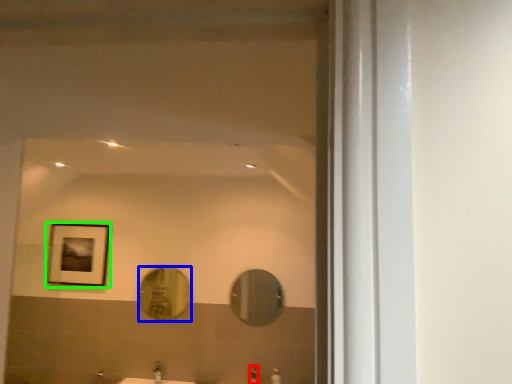
Question: Which is nearer to the faucet (highlighted by a red box)? mirror (highlighted by a blue box) or picture frame (highlighted by a green box).

Choices:
 (A) mirror
 (B) picture frame

Answer: (A)